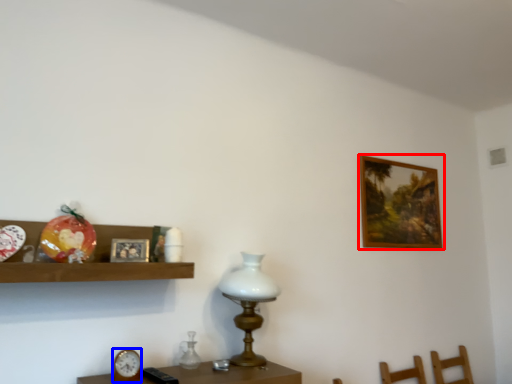
Question: Which of the following is the farthest to the observer, picture frame (highlighted by a red box) or clock (highlighted by a blue box)?

Choices:
 (A) picture frame
 (B) clock

Answer: (A)